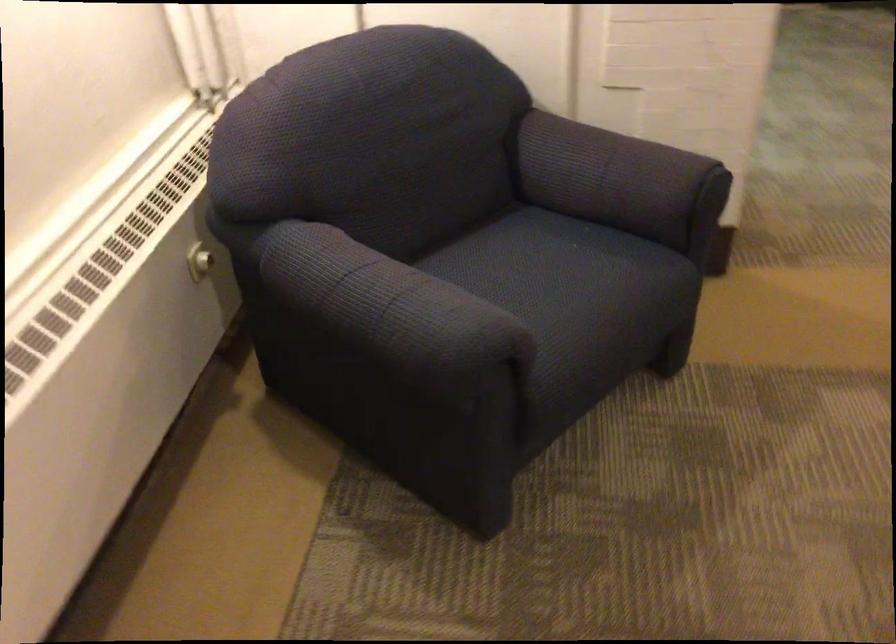
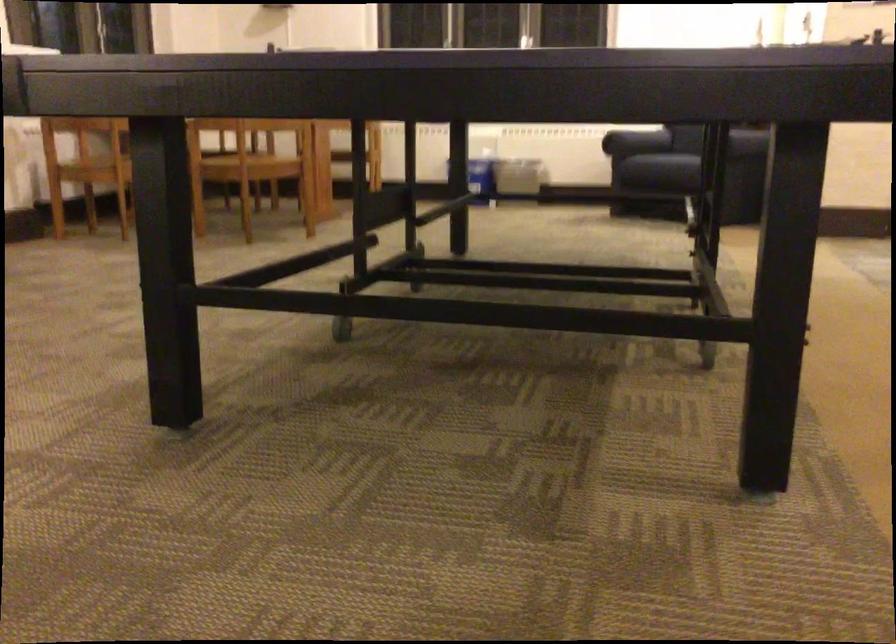
The point at (600, 328) is marked in the first image. Where is the corresponding point in the second image?

(633, 143)